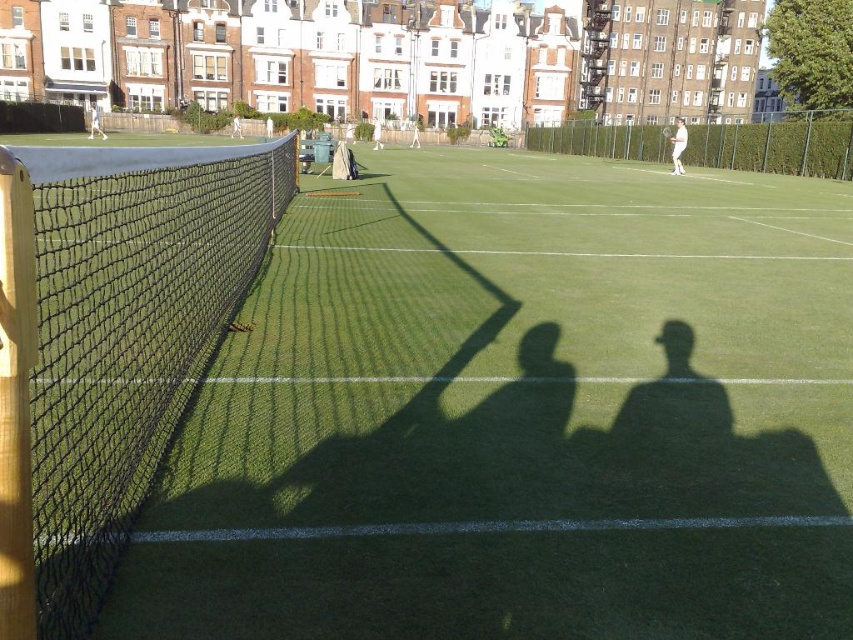
Question: Which object is positioned farthest from the white fabric tennis racket at center?

Choices:
 (A) white fabric tennis racket at upper left
 (B) black mesh net at left
 (C) white cotton tennis racket at right
 (D) white fabric tennis racket at upper center

Answer: (B)

Question: Which point is farther to the camera?

Choices:
 (A) white fabric tennis racket at upper left
 (B) white plastic racket at center

Answer: (A)

Question: Which point is closer to the camera?

Choices:
 (A) white cotton tennis racket at right
 (B) white fabric tennis racket at center

Answer: (A)

Question: Is black mesh net at left above white cotton tennis racket at right?

Choices:
 (A) yes
 (B) no

Answer: (B)

Question: Is white cotton tennis racket at right bigger than white fabric tennis racket at center?

Choices:
 (A) no
 (B) yes

Answer: (B)

Question: Does white cotton tennis racket at right appear over white fabric tennis racket at upper left?

Choices:
 (A) yes
 (B) no

Answer: (B)